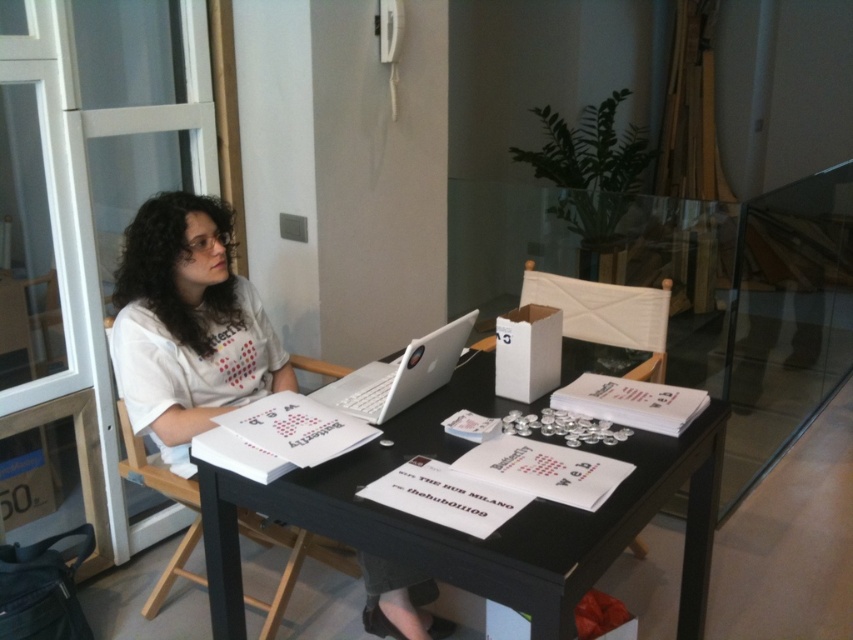
Question: Does transparent glass table at center lie in front of white cotton shirt at center?

Choices:
 (A) yes
 (B) no

Answer: (B)

Question: Does black glossy table at center appear on the left side of white cotton shirt at center?

Choices:
 (A) no
 (B) yes

Answer: (A)

Question: Which point appears farthest from the camera in this image?

Choices:
 (A) (393, 410)
 (B) (515, 529)
 (C) (165, 442)

Answer: (C)

Question: Considering the real-world distances, which object is farthest from the transparent glass table at center?

Choices:
 (A) silver metallic laptop at center
 (B) white cotton shirt at center
 (C) black glossy table at center

Answer: (B)

Question: Which point is closer to the camera?

Choices:
 (A) silver metallic laptop at center
 (B) white cotton shirt at center
 (C) transparent glass table at center
 (D) black glossy table at center

Answer: (D)

Question: Does transparent glass table at center appear under black glossy table at center?

Choices:
 (A) yes
 (B) no

Answer: (B)